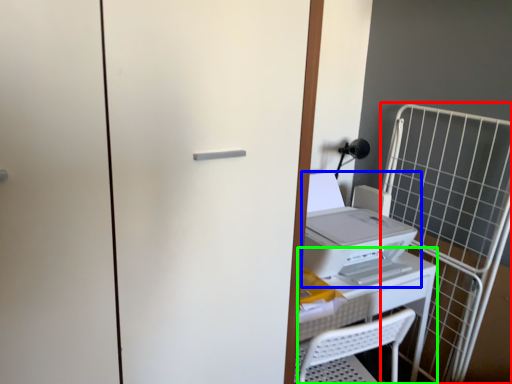
Question: Which object is the closest to the cage (highlighted by a red box)? Choose among these: home appliance (highlighted by a blue box) or table (highlighted by a green box).

Choices:
 (A) home appliance
 (B) table

Answer: (B)